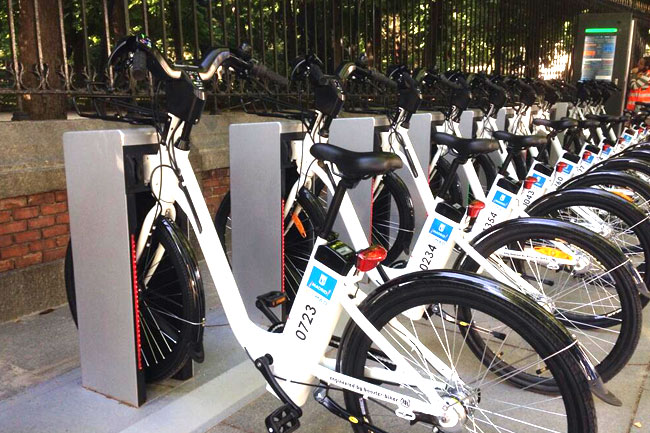
The image size is (650, 433). In order to click on slanted frame in this screenshot , I will do `click(228, 276)`, `click(343, 230)`, `click(424, 182)`, `click(469, 181)`, `click(502, 153)`, `click(560, 148)`, `click(582, 132)`, `click(598, 129)`, `click(606, 133)`.